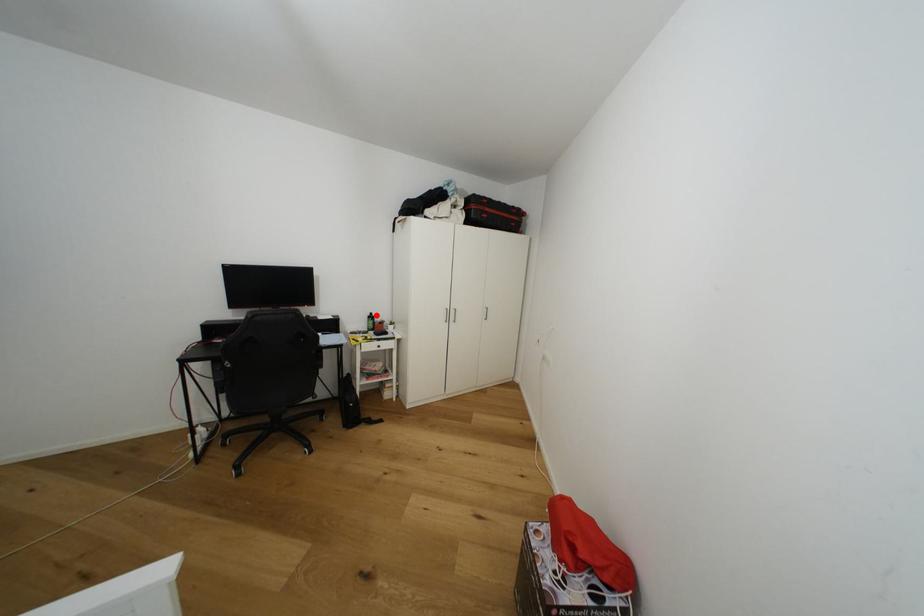
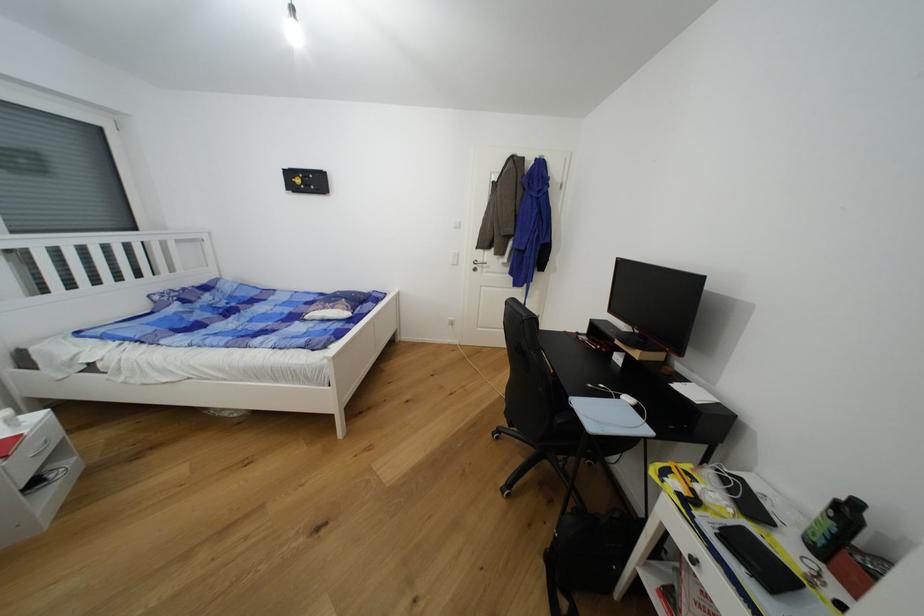
In the second image, find the point that corresponds to the highlighted location in the first image.

(862, 506)